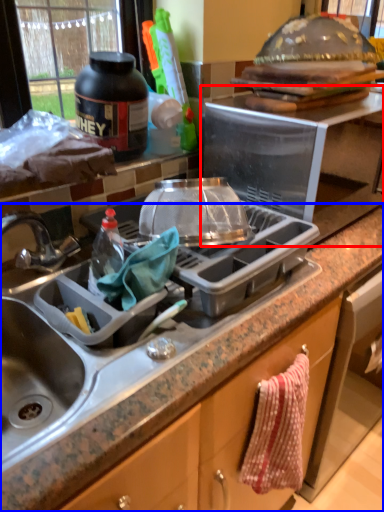
Question: Which object is further to the camera taking this photo, appliance (highlighted by a red box) or countertop (highlighted by a blue box)?

Choices:
 (A) appliance
 (B) countertop

Answer: (A)